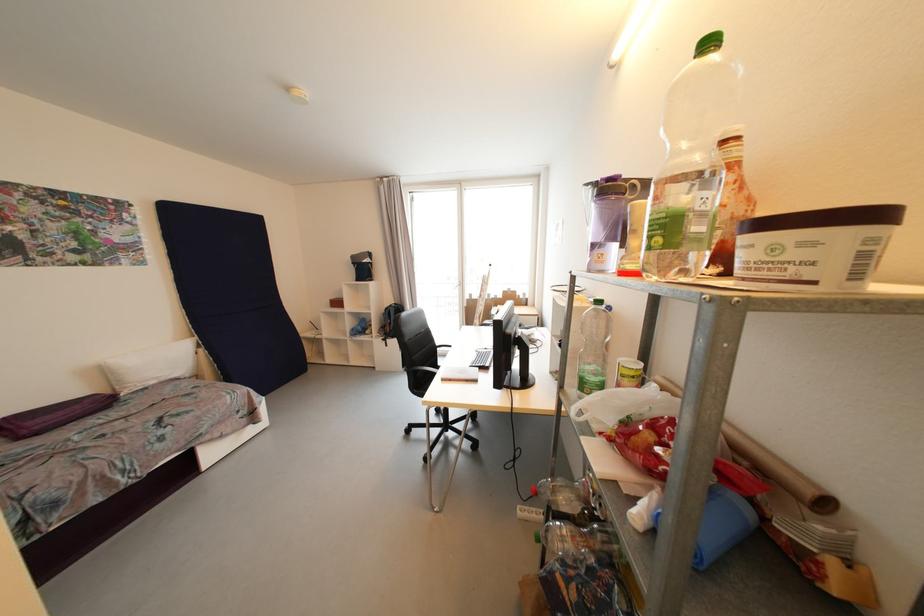
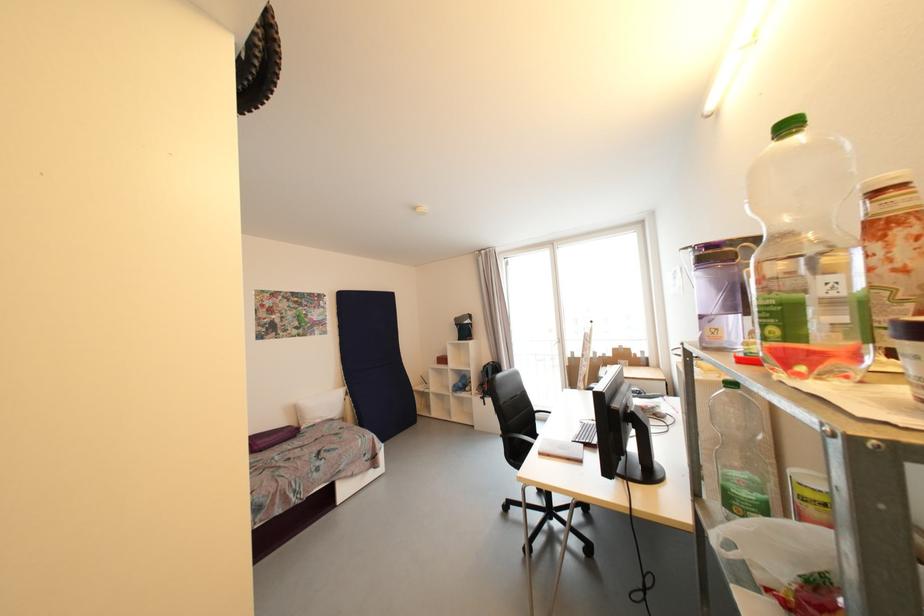
Locate, in the second image, the point that corresponds to point 424,386 in the first image.

(520, 456)